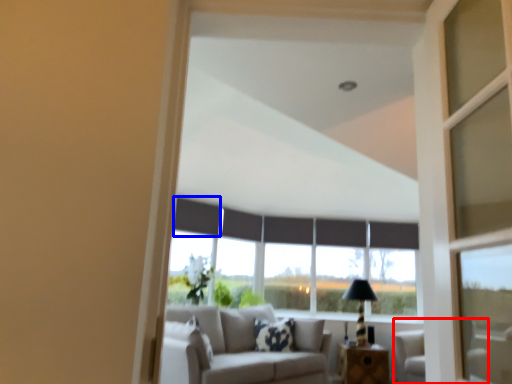
Question: Among these objects, which one is nearest to the camera, armchair (highlighted by a red box) or curtain (highlighted by a blue box)?

Choices:
 (A) armchair
 (B) curtain

Answer: (A)